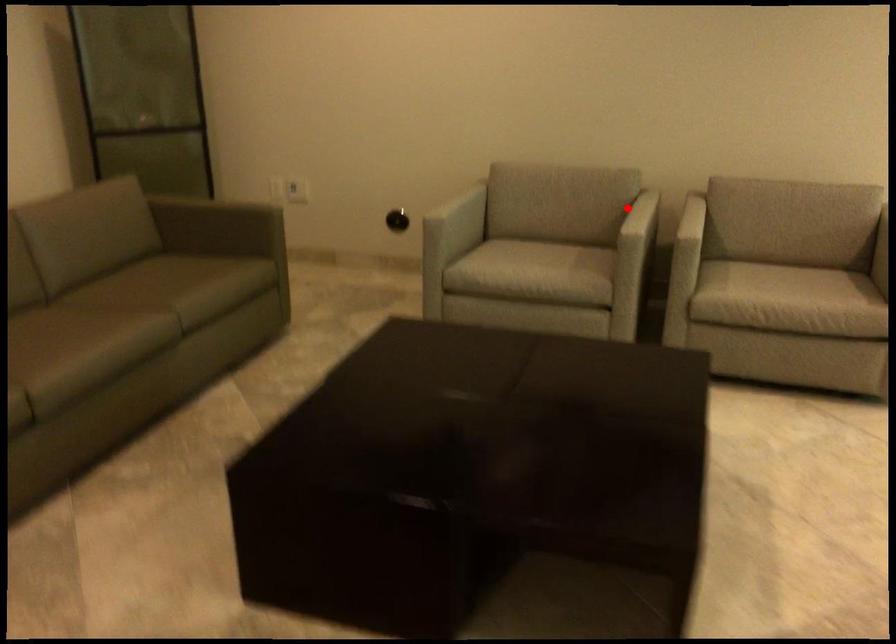
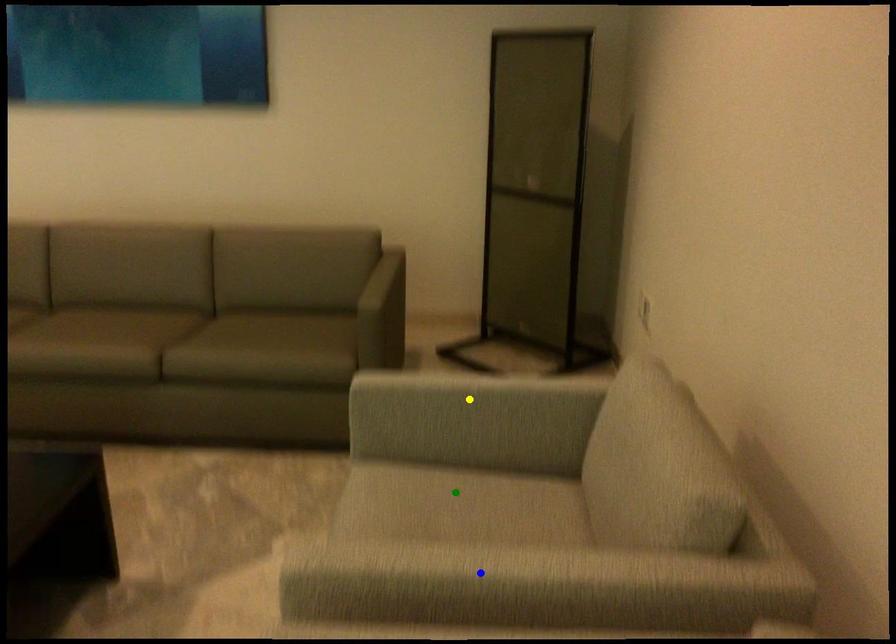
Question: I am providing you with two images of the same scene from different viewpoints. A red point is marked on the first image. You are given multiple points on the second image. Can you choose the point in image 2 that corresponds to the point in image 1?

Choices:
 (A) yellow point
 (B) blue point
 (C) green point

Answer: (B)